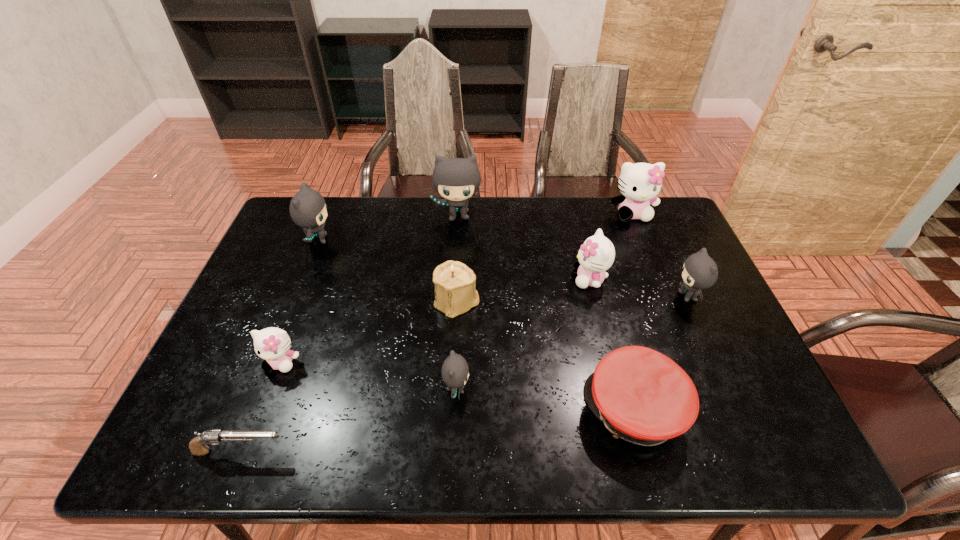
Image resolution: width=960 pixels, height=540 pixels. I want to click on vacant space that satisfies the following two spatial constraints: 1. on the front-facing side of the biggest gray kitten; 2. on the right side of the candle_holder, so click(453, 301).